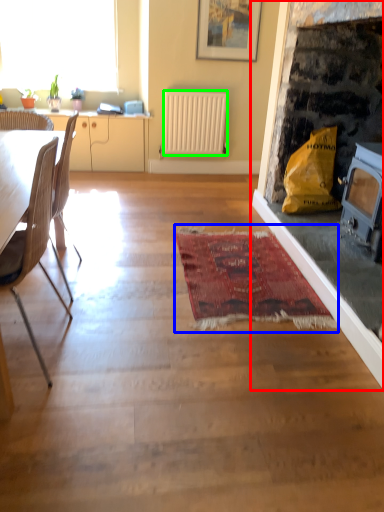
Question: Considering the real-world distances, which object is farthest from fireplace (highlighted by a red box)? mat (highlighted by a blue box) or radiator (highlighted by a green box)?

Choices:
 (A) mat
 (B) radiator

Answer: (B)